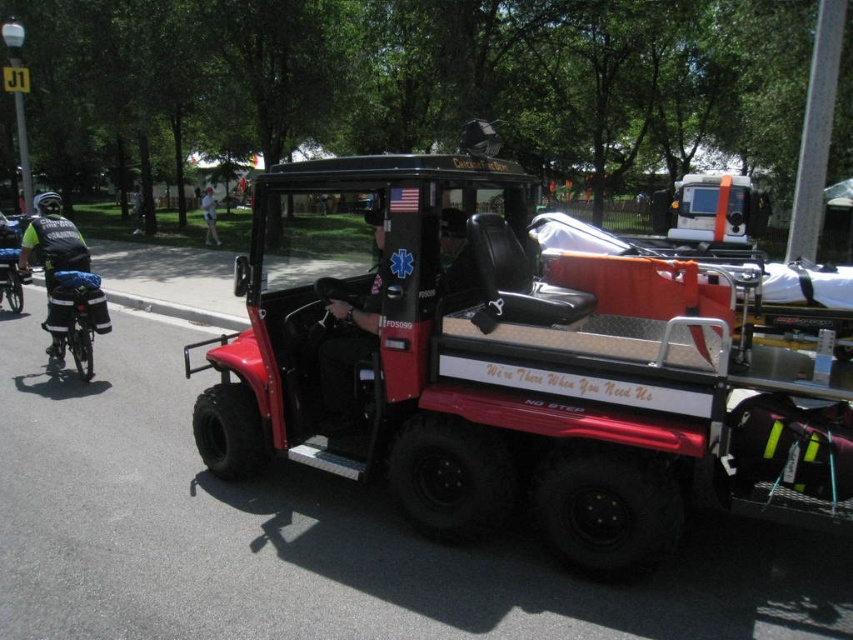
You are an emergency responder preparing for a call. You see the matte black helmet at center and the blue fabric bag at left. Which item should you grab first if you need the larger one?

The blue fabric bag at left is larger than the matte black helmet at center, so you should grab the blue fabric bag at left first.